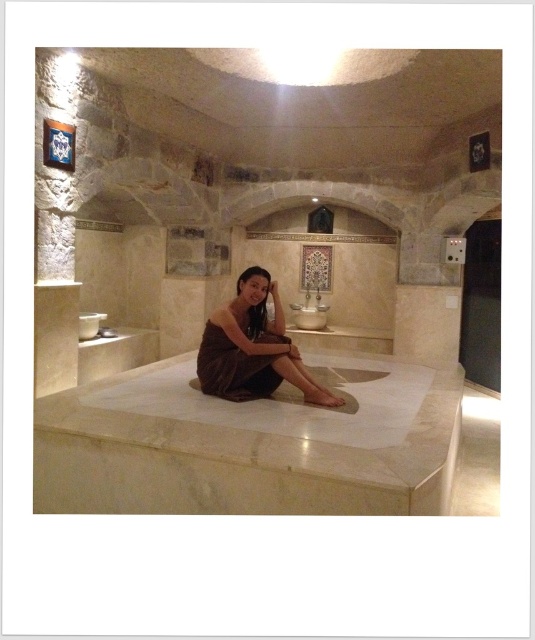
Question: Considering the real-world distances, which object is farthest from the brown fabric at center?

Choices:
 (A) white marble bathtub at center
 (B) brown satin dress at center

Answer: (A)

Question: Which is nearer to the white marble bathtub at center?

Choices:
 (A) brown satin dress at center
 (B) brown fabric at center

Answer: (A)

Question: Among these points, which one is nearest to the camera?

Choices:
 (A) coord(97,456)
 (B) coord(265,356)
 (C) coord(217,310)

Answer: (A)

Question: From the image, what is the correct spatial relationship of white marble bathtub at center in relation to brown satin dress at center?

Choices:
 (A) right
 (B) left

Answer: (A)

Question: Does white marble bathtub at center appear on the left side of brown fabric at center?

Choices:
 (A) yes
 (B) no

Answer: (A)

Question: Is white marble bathtub at center below brown fabric at center?

Choices:
 (A) no
 (B) yes

Answer: (B)